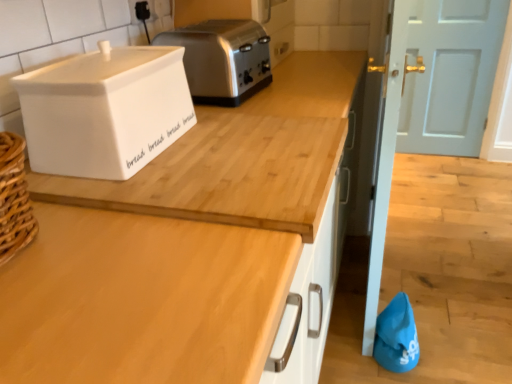
Find the location of a particular element. The image size is (512, 384). vacant area situated below light blue painted wood door at upper right (from a real-world perspective) is located at coordinates (438, 149).